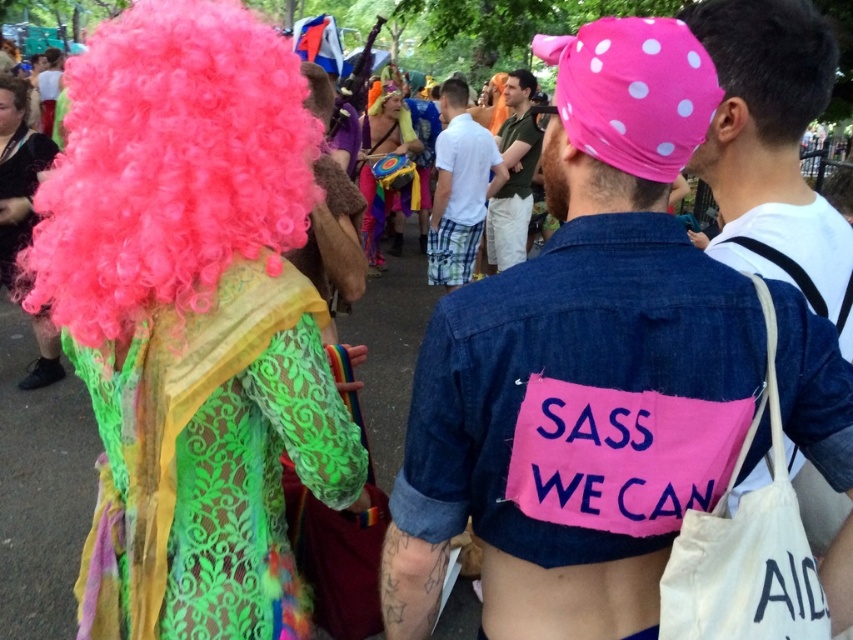
You are a photographer trying to capture the neon curly wig at upper left and the brown curly hair at center in a single frame. Based on their positions, which one would appear closer to the bottom of the photo?

The neon curly wig at upper left appears closer to the bottom of the photo because it is located below the brown curly hair at center.

You are a photographer trying to capture a photo of the neon curly wig at upper left and the brown curly hair at center. Based on their positions, which one should you adjust your camera to focus on first to ensure both are in the frame?

The neon curly wig at upper left should be focused on first since it is positioned to the left of the brown curly hair at center, allowing you to frame both by adjusting your camera from left to right.